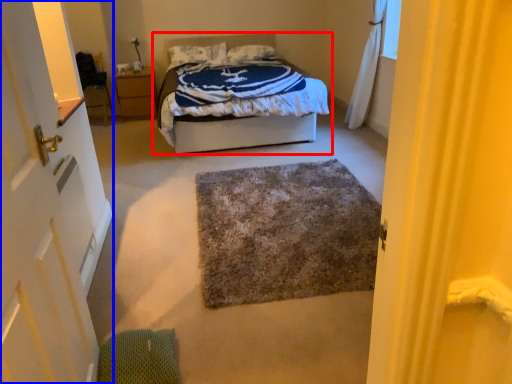
Question: Which object appears farthest to the camera in this image, bed (highlighted by a red box) or door (highlighted by a blue box)?

Choices:
 (A) bed
 (B) door

Answer: (A)